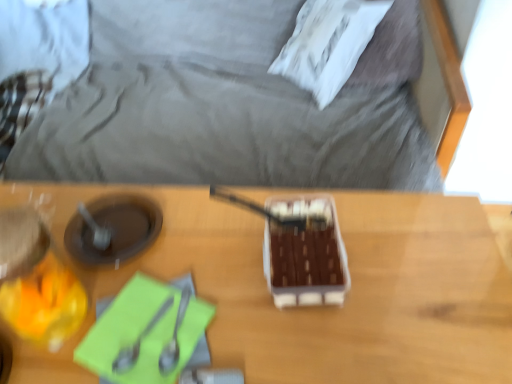
Identify the location of free spot to the right of satin silver spoon at center, marked as the 1th utensil in a right-to-left arrangement. This screenshot has height=384, width=512. (267, 326).